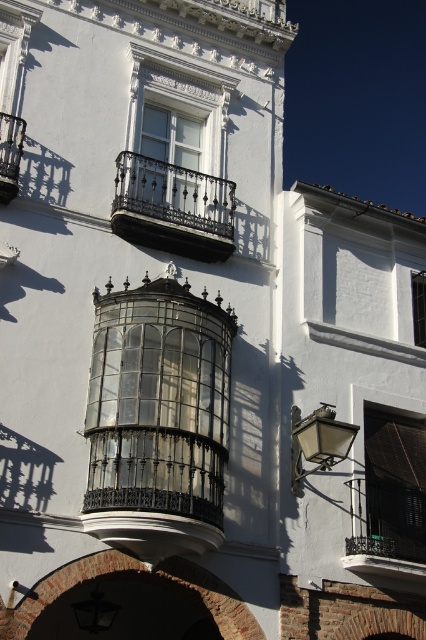
Question: Among these points, which one is nearest to the camera?

Choices:
 (A) (81, 598)
 (B) (0, 122)
 (C) (172, 522)

Answer: (C)

Question: Does black wrought iron balcony at upper center have a greater width compared to clear glass window at upper right?

Choices:
 (A) no
 (B) yes

Answer: (B)

Question: Which point is farther from the camera taking this photo?

Choices:
 (A) (201, 604)
 (B) (397, 552)
 (C) (5, 166)
 (D) (226, 180)

Answer: (D)

Question: Does black wrought iron balcony at upper left have a lesser width compared to clear glass window at upper right?

Choices:
 (A) no
 (B) yes

Answer: (A)

Question: Is white glass window at upper center to the right of clear glass window at upper right from the viewer's perspective?

Choices:
 (A) yes
 (B) no

Answer: (B)

Question: Which of these objects is positioned farthest from the black wrought iron balcony at upper center?

Choices:
 (A) red brick archway at lower center
 (B) clear glass window at upper right
 (C) clear glass bay window at center
 (D) white glass window at upper center

Answer: (A)